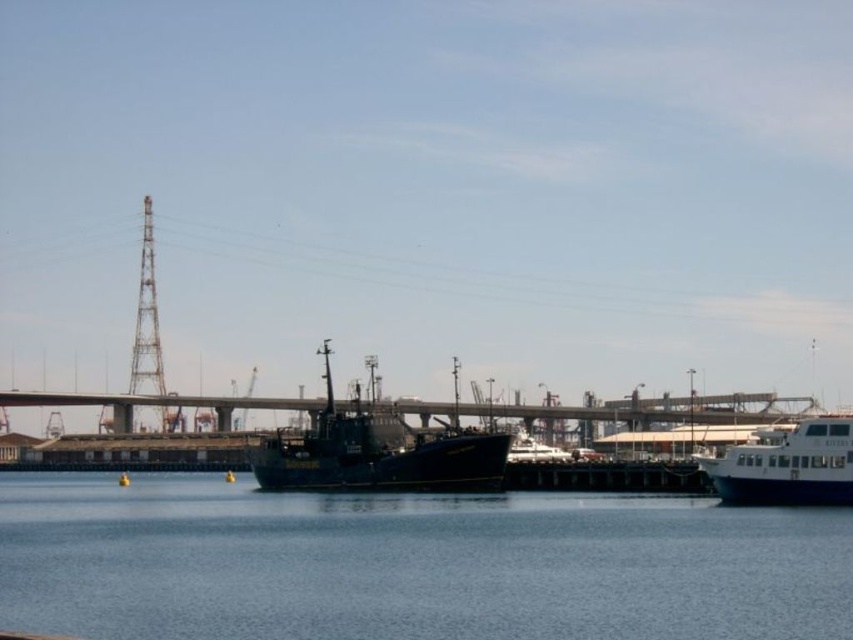
You are a sailor trying to navigate between the blue water at center and the matte black ship at center. Which direction should you steer your boat to move from the ship towards the water?

The blue water at center is positioned on the right side of matte black ship at center, so you should steer your boat to the right to move from the ship towards the water.

You are a photographer standing on the dock. You want to capture a photo where both the blue water at center and the white glossy ferry at right are clearly visible. Based on their positions, which object should you focus on first to ensure both are in frame?

The blue water at center is taller than the white glossy ferry at right, so you should focus on the blue water at center first to ensure both are in frame.